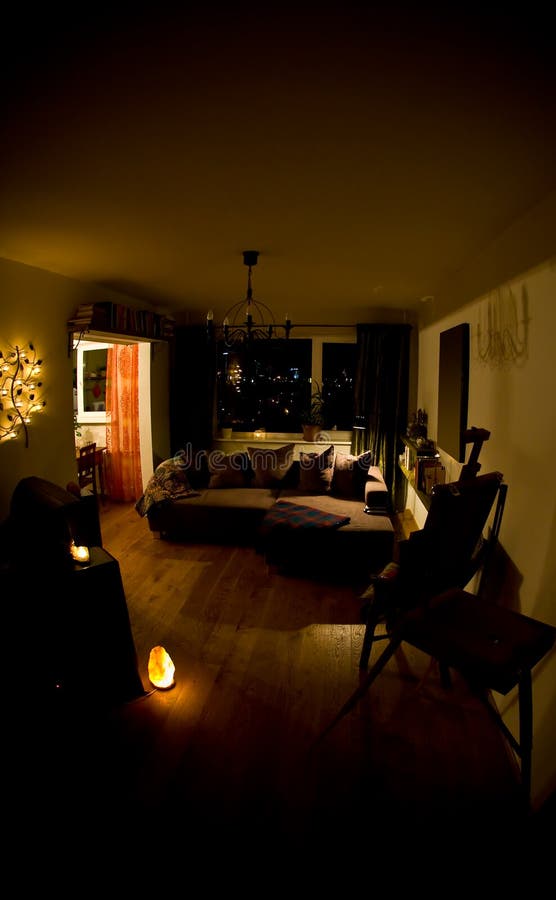
The width and height of the screenshot is (556, 900). I want to click on salt rock lamp, so click(160, 667).